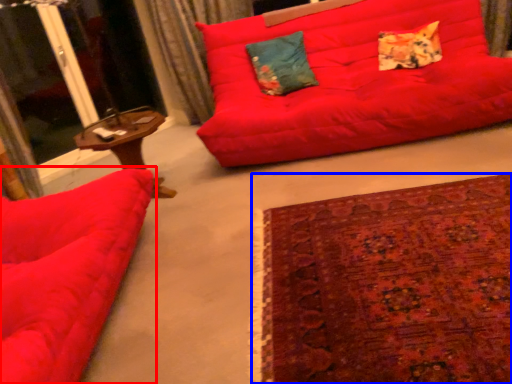
Question: Among these objects, which one is farthest to the camera, studio couch (highlighted by a red box) or plain (highlighted by a blue box)?

Choices:
 (A) studio couch
 (B) plain

Answer: (B)